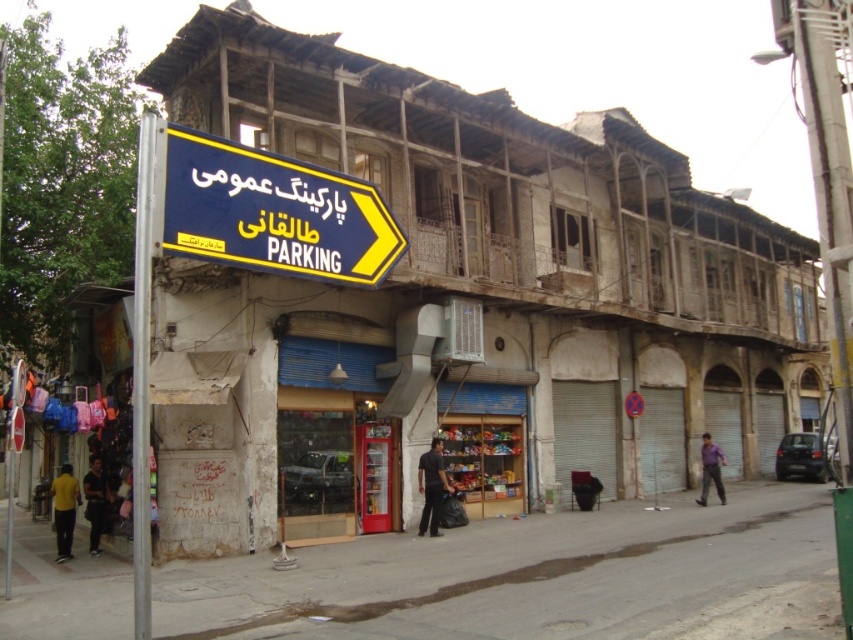
Which is in front, point (635, 216) or point (322, 200)?

Point (322, 200) is in front.

Between blue painted metal signboard at upper left and blue plastic sign at upper left, which one appears on the left side from the viewer's perspective?

blue plastic sign at upper left

The image size is (853, 640). Describe the element at coordinates (467, 300) in the screenshot. I see `blue painted metal signboard at upper left` at that location.

Where is `blue painted metal signboard at upper left`? The height and width of the screenshot is (640, 853). blue painted metal signboard at upper left is located at coordinates (467, 300).